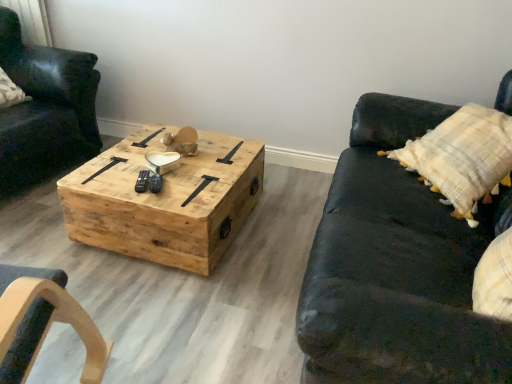
Question: Is black leather couch at right oriented towards natural wood coffee table at center?

Choices:
 (A) no
 (B) yes

Answer: (B)

Question: Considering the relative sizes of black leather couch at right and natural wood coffee table at center in the image provided, is black leather couch at right thinner than natural wood coffee table at center?

Choices:
 (A) yes
 (B) no

Answer: (B)

Question: Is the depth of black leather couch at right greater than that of natural wood coffee table at center?

Choices:
 (A) no
 (B) yes

Answer: (A)

Question: Considering the relative sizes of black leather couch at right and natural wood coffee table at center in the image provided, is black leather couch at right smaller than natural wood coffee table at center?

Choices:
 (A) yes
 (B) no

Answer: (B)

Question: From the image's perspective, is black leather couch at right under natural wood coffee table at center?

Choices:
 (A) no
 (B) yes

Answer: (B)

Question: Would you consider black leather couch at right to be distant from natural wood coffee table at center?

Choices:
 (A) yes
 (B) no

Answer: (B)

Question: Is natural wood coffee table at center positioned beyond the bounds of black leather couch at right?

Choices:
 (A) no
 (B) yes

Answer: (B)

Question: Considering the relative sizes of natural wood coffee table at center and black leather couch at right in the image provided, is natural wood coffee table at center thinner than black leather couch at right?

Choices:
 (A) no
 (B) yes

Answer: (B)

Question: Is natural wood coffee table at center aimed at black leather couch at right?

Choices:
 (A) yes
 (B) no

Answer: (B)

Question: From the image's perspective, is natural wood coffee table at center below black leather couch at right?

Choices:
 (A) no
 (B) yes

Answer: (A)

Question: From a real-world perspective, is natural wood coffee table at center physically above black leather couch at right?

Choices:
 (A) yes
 (B) no

Answer: (B)

Question: Is the depth of natural wood coffee table at center greater than that of black leather couch at right?

Choices:
 (A) yes
 (B) no

Answer: (A)

Question: Is matte black leather chair at left taller than black leather couch at right?

Choices:
 (A) no
 (B) yes

Answer: (B)